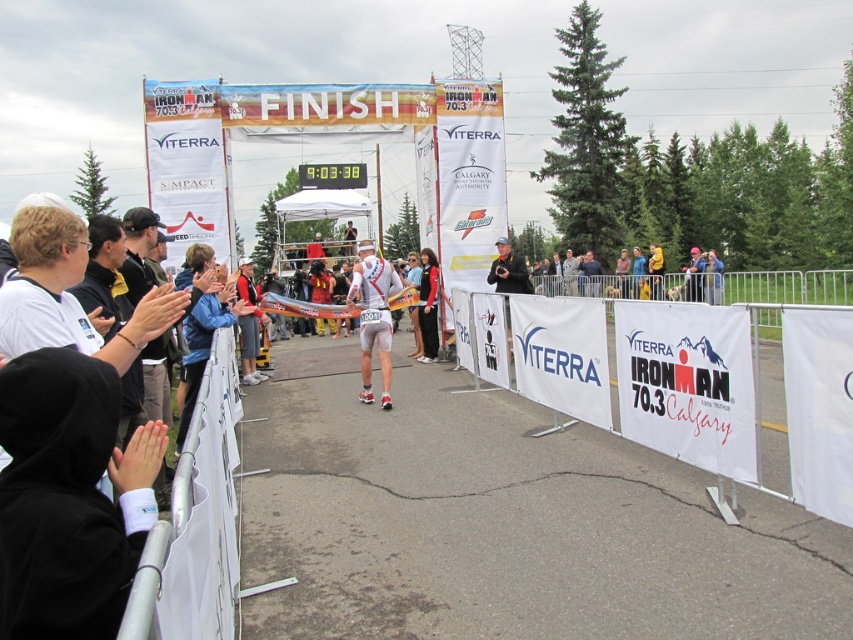
Question: Which of the following is the farthest from the observer?

Choices:
 (A) white fabric banner at center
 (B) black fabric at center
 (C) white plastic barrier at lower left
 (D) black fabric jacket at center

Answer: (D)

Question: Which of the following is the farthest from the observer?

Choices:
 (A) (512, 272)
 (B) (375, 273)

Answer: (A)

Question: Is white plastic barrier at lower left thinner than white matte triathlon suit at center?

Choices:
 (A) yes
 (B) no

Answer: (B)

Question: Does white plastic barrier at lower left appear on the right side of red fabric jacket at center?

Choices:
 (A) yes
 (B) no

Answer: (A)

Question: Does white matte triathlon suit at center have a larger size compared to black fabric jacket at center?

Choices:
 (A) yes
 (B) no

Answer: (B)

Question: Based on their relative distances, which object is nearer to the red fabric jacket at center?

Choices:
 (A) black fabric jacket at center
 (B) white fabric banner at center
 (C) white plastic barrier at lower left

Answer: (A)